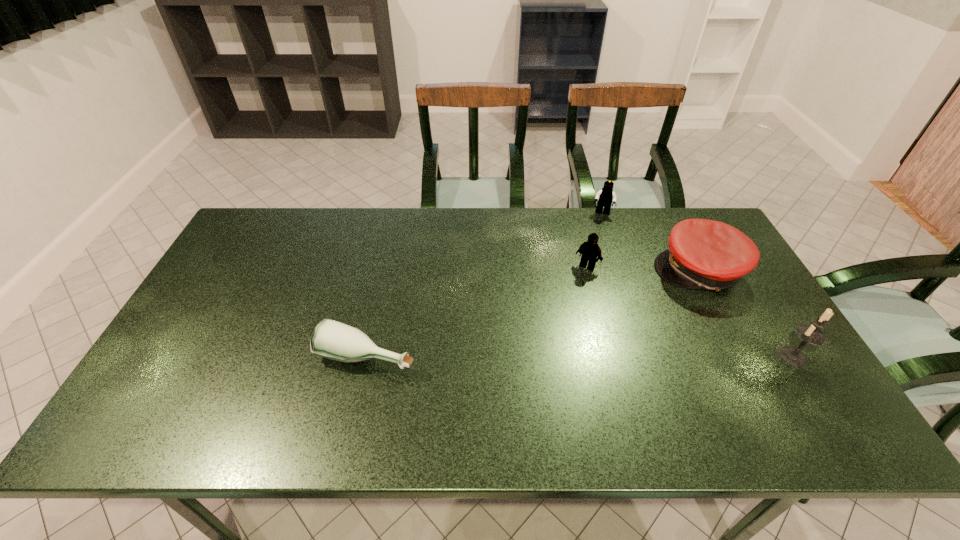
Find the location of a particular element. the fourth closest object to the farther Lego is located at coordinates (333, 340).

Image resolution: width=960 pixels, height=540 pixels. Find the location of `object that is the third closest to the shortest object`. object that is the third closest to the shortest object is located at coordinates (605, 197).

Identify the location of vacant region that satisfies the following two spatial constraints: 1. on the front side of the tallest object; 2. on the right side of the left Lego. The height and width of the screenshot is (540, 960). [611, 356].

Find the location of a particular element. The image size is (960, 540). free location that satisfies the following two spatial constraints: 1. on the front side of the nearer Lego; 2. on the left side of the candle holder is located at coordinates (611, 356).